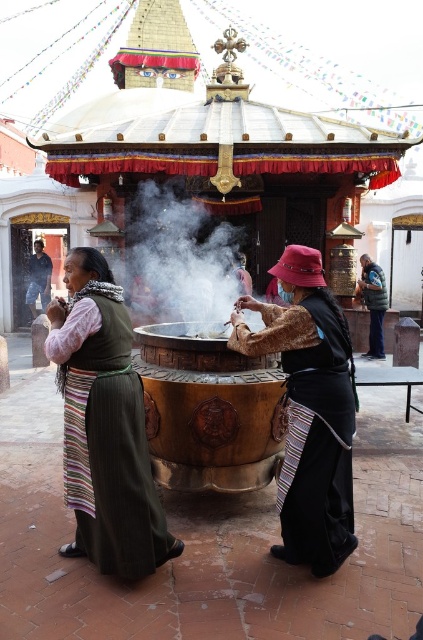
Is point (310, 308) less distant than point (167, 262)?

Yes, it is in front of point (167, 262).

Does point (290, 260) come behind point (173, 195)?

No, it is in front of (173, 195).

At what (x,y) coordinates should I click in order to perform the action: click on velvet brown hat at center. Please return your answer as a coordinate pair (x, y). This screenshot has height=640, width=423. Looking at the image, I should click on (308, 410).

Can you confirm if smoketransparent at center is shorter than dark blue jeans at lower left?

No, smoketransparent at center is not shorter than dark blue jeans at lower left.

Can you confirm if smoketransparent at center is taller than dark blue jeans at lower left?

Correct, smoketransparent at center is much taller as dark blue jeans at lower left.

Image resolution: width=423 pixels, height=640 pixels. What are the coordinates of `smoketransparent at center` in the screenshot? It's located at (178, 259).

Where is `smoketransparent at center`? The height and width of the screenshot is (640, 423). smoketransparent at center is located at coordinates (178, 259).

Between green woven skirt at center and dark blue puffy jacket at center, which one is positioned higher?

dark blue puffy jacket at center is above.

Can you confirm if green woven skirt at center is positioned below dark blue puffy jacket at center?

Yes, green woven skirt at center is below dark blue puffy jacket at center.

Is point (131, 442) farther from camera compared to point (378, 268)?

No, (131, 442) is in front of (378, 268).

The width and height of the screenshot is (423, 640). Find the location of `green woven skirt at center`. green woven skirt at center is located at coordinates (104, 426).